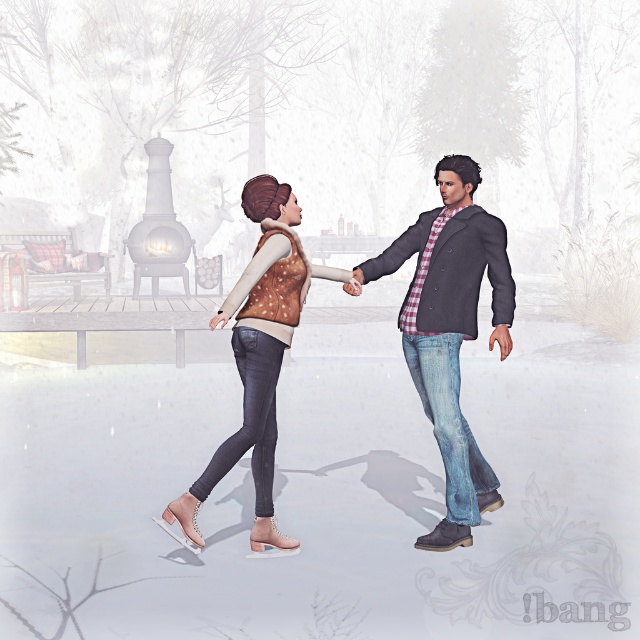
You are a photographer standing at the edge of the frozen lake. You want to take a photo of the two skaters holding hands. The coordinates of their hands are point (268, 406) and point (484, 240). Which hand is closer to your camera?

Point (268, 406) is closer to the camera than point (484, 240).

You are organizing a winter clothing display and need to arrange the matte brown vest at center and the denim jacket at right based on their sizes. Which one should be placed first in a size order from largest to smallest?

The matte brown vest at center should be placed first in the size order from largest to smallest since it has a larger size compared to the denim jacket at right.

You are an observer standing on the lakeside watching the ice skaters. Which clothing item is positioned lower in the image, the matte brown vest at center or the denim jacket at right?

The matte brown vest at center is positioned lower in the image than the denim jacket at right.